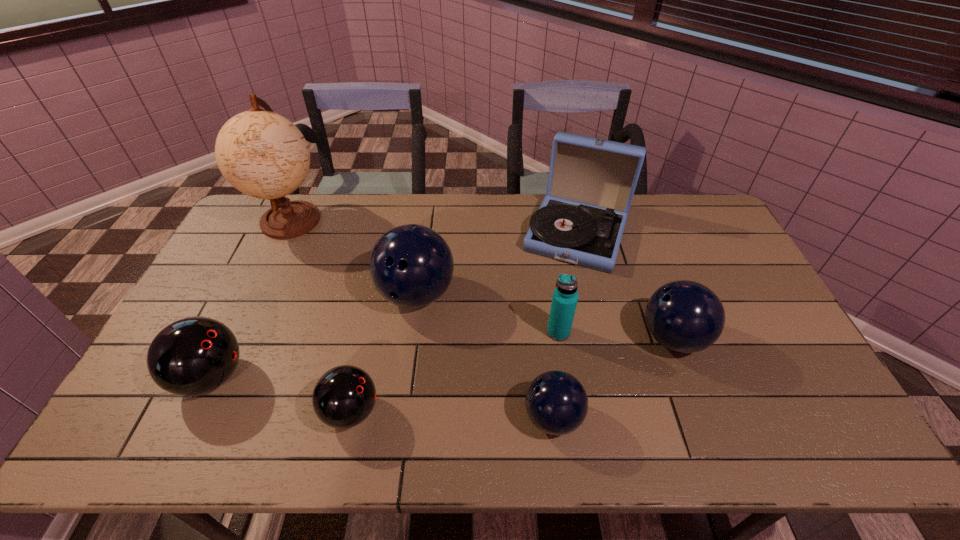
Where is `the left black bowling ball`? The image size is (960, 540). the left black bowling ball is located at coordinates (192, 356).

Locate an element on the screen. Image resolution: width=960 pixels, height=540 pixels. the smallest blue bowling ball is located at coordinates (556, 402).

You are a GUI agent. You are given a task and a screenshot of the screen. Output one action in this format:
    pyautogui.click(x=<x>, y=<y>)
    Task: Click on the second bowling ball from right to left
    Image resolution: width=960 pixels, height=540 pixels.
    Given the screenshot: What is the action you would take?
    pyautogui.click(x=556, y=402)

The width and height of the screenshot is (960, 540). What are the coordinates of `the right black bowling ball` in the screenshot? It's located at (344, 396).

Where is `vacant space located on the surface of the beige globe`? The height and width of the screenshot is (540, 960). vacant space located on the surface of the beige globe is located at coordinates click(248, 312).

Locate an element on the screen. vacant area situated on the left of the phonograph record is located at coordinates (469, 233).

Locate an element on the screen. This screenshot has height=540, width=960. free space located on the surface of the leftmost blue bowling ball near the finger holes is located at coordinates (408, 355).

Find the location of a particular element. free spot located on the right of the water bottle is located at coordinates (616, 332).

Image resolution: width=960 pixels, height=540 pixels. Find the location of `free space located on the surface of the rightmost bowling ball near the finger holes`. free space located on the surface of the rightmost bowling ball near the finger holes is located at coordinates (592, 338).

At what (x,y) coordinates should I click in order to perform the action: click on vacant region located on the surface of the rightmost bowling ball near the finger holes. Please return your answer as a coordinate pair (x, y). The width and height of the screenshot is (960, 540). Looking at the image, I should click on (585, 338).